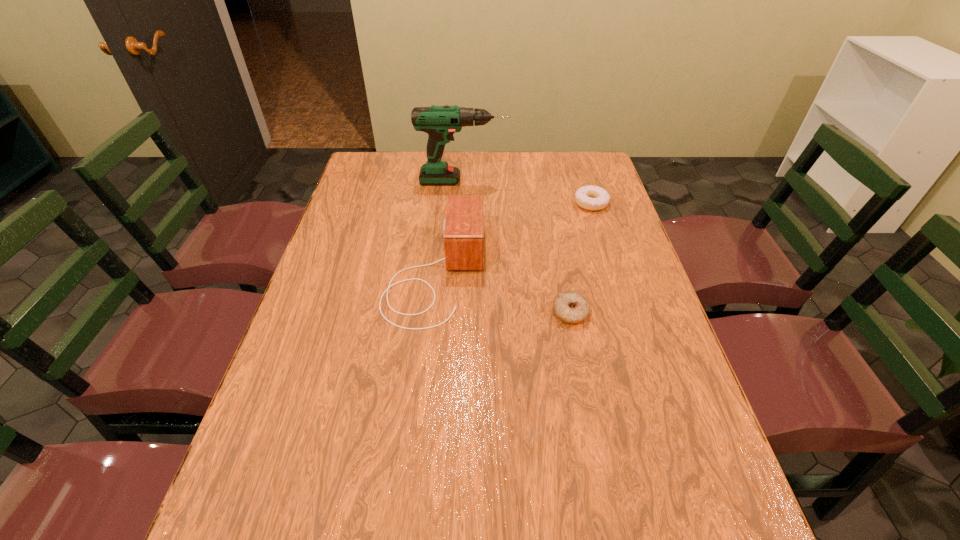
What are the coordinates of `free space between the farthest object and the left doughnut` in the screenshot? It's located at (516, 247).

I want to click on blank region between the radio receiver and the farther doughnut, so click(x=514, y=238).

Where is `free spot between the farther doughnut and the tallest object`? free spot between the farther doughnut and the tallest object is located at coordinates (527, 192).

Find the location of a particular element. vacant space that is in between the farther doughnut and the radio receiver is located at coordinates (514, 238).

You are a GUI agent. You are given a task and a screenshot of the screen. Output one action in this format:
    pyautogui.click(x=<x>, y=<y>)
    Task: Click on the unoccupied position between the farther doughnut and the left doughnut
    The height and width of the screenshot is (540, 960).
    Given the screenshot: What is the action you would take?
    pyautogui.click(x=581, y=258)

Where is `free space between the right doughnut and the radio receiver`? This screenshot has height=540, width=960. free space between the right doughnut and the radio receiver is located at coordinates (514, 238).

Identify the location of vacant area between the radio receiver and the nearer doughnut. (503, 293).

Image resolution: width=960 pixels, height=540 pixels. What are the coordinates of `object that is the third closest one to the tallest object` in the screenshot? It's located at (570, 307).

The height and width of the screenshot is (540, 960). Find the location of `object that is the closest one to the right doughnut`. object that is the closest one to the right doughnut is located at coordinates (440, 122).

At what (x,y) coordinates should I click in order to perform the action: click on vacant space that satisfies the following two spatial constraints: 1. on the back side of the second object from right to left; 2. on the right side of the second farthest object. Please return your answer as a coordinate pair (x, y). The image size is (960, 540). Looking at the image, I should click on (549, 203).